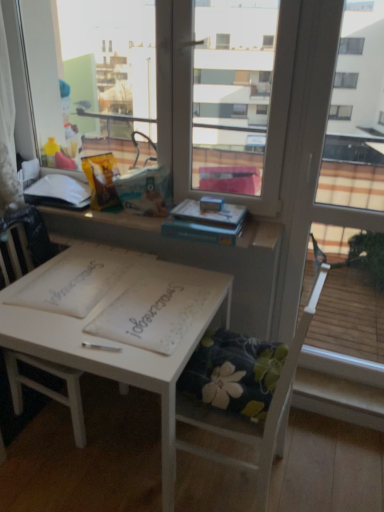
Question: Would you say white matte book at upper left, acting as the 2th book starting from the front, is to the left or to the right of floral fabric cushion at lower center, the 2th chair when ordered from left to right, in the picture?

Choices:
 (A) right
 (B) left

Answer: (B)

Question: From the image's perspective, is white matte book at upper left, marked as the 1th book in a back-to-front arrangement, above or below floral fabric cushion at lower center, the 1th chair when ordered from right to left?

Choices:
 (A) above
 (B) below

Answer: (A)

Question: Which object is positioned farthest from the white painted wood table at center?

Choices:
 (A) hardcover book at upper center, arranged as the second book when viewed from the left
 (B) white paper notebook at center, the 1th notebook in the left-to-right sequence
 (C) white wood chair at center, which is the 1th chair in left-to-right order
 (D) floral fabric cushion at lower center, the 2th chair when ordered from left to right
 (E) white matte book at upper left, acting as the second book starting from the right

Answer: (E)

Question: Which object is the closest to the white wood chair at center, which is the 1th chair in left-to-right order?

Choices:
 (A) white matte book at upper left, marked as the 1th book in a back-to-front arrangement
 (B) white painted wood table at center
 (C) white paper notebook at center, marked as the 2th notebook in a right-to-left arrangement
 (D) hardcover book at upper center, which appears as the second book when viewed from the back
 (E) floral fabric cushion at lower center, the 2th chair when ordered from left to right

Answer: (C)